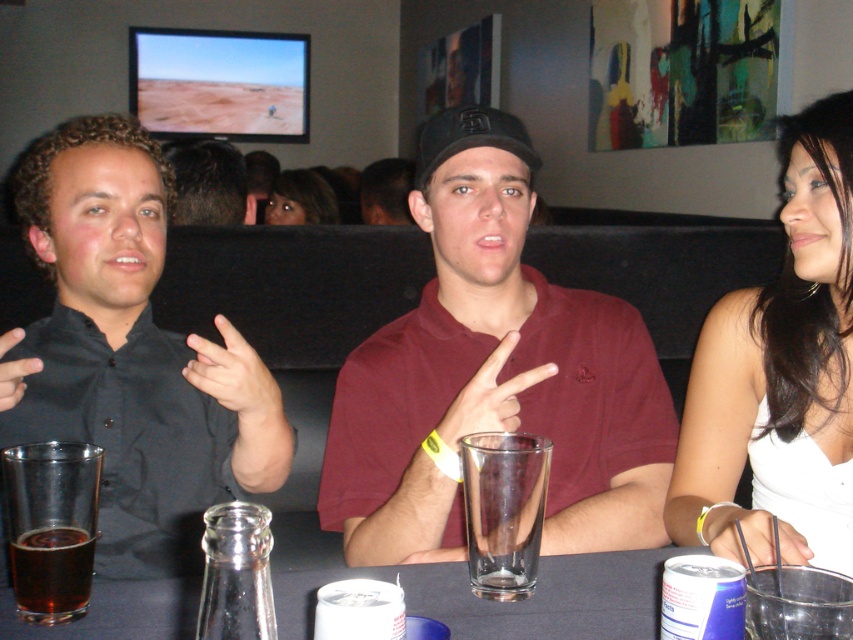
You are a photographer trying to capture a group photo of the dark gray shirt at left and the dark brown hair at center. Since you want to ensure both subjects are in focus, you need to know their relative sizes. Which subject should you adjust your camera settings for to account for their size difference?

The dark gray shirt at left is larger in size than the dark brown hair at center, so you should adjust your camera settings to focus on the larger subject first to ensure both are in focus.

You are a waiter at this casual dining venue and need to deliver a drink to the table. The drink must be placed exactly 24 inches away from the maroon polo shirt at center to avoid spills. Is the current position of the dark amber liquid at lower left suitable for placing the drink?

The dark amber liquid at lower left is currently 22.35 inches away from the maroon polo shirt at center, which is less than the required 24 inches. Therefore, the current position is not suitable for placing the drink as it does not meet the distance requirement.